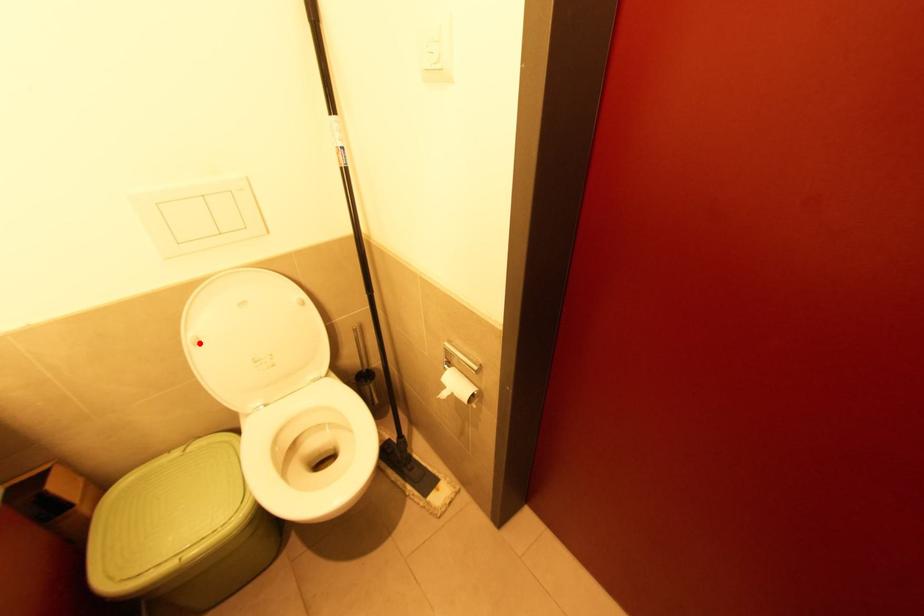
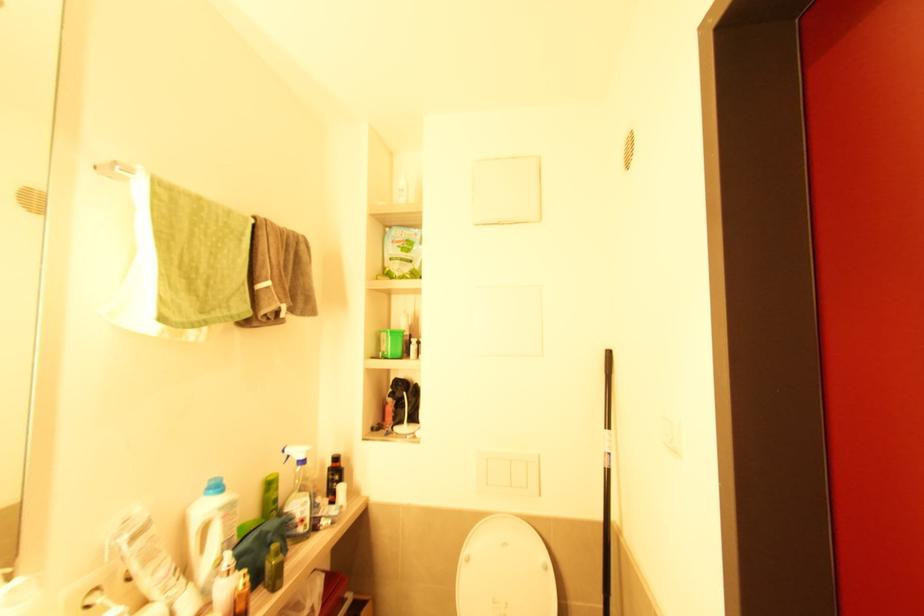
Locate, in the second image, the point that corresponds to the highlighted location in the first image.

(469, 561)